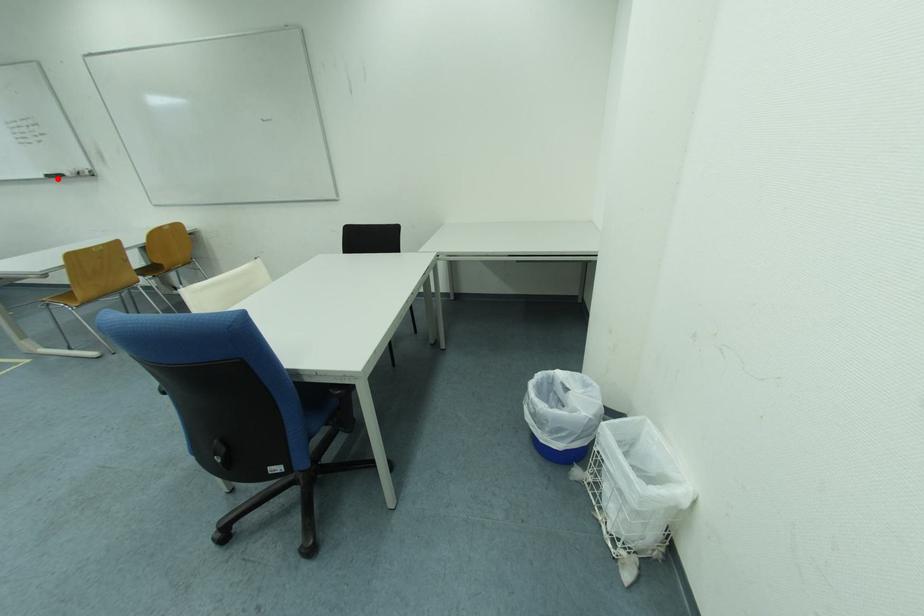
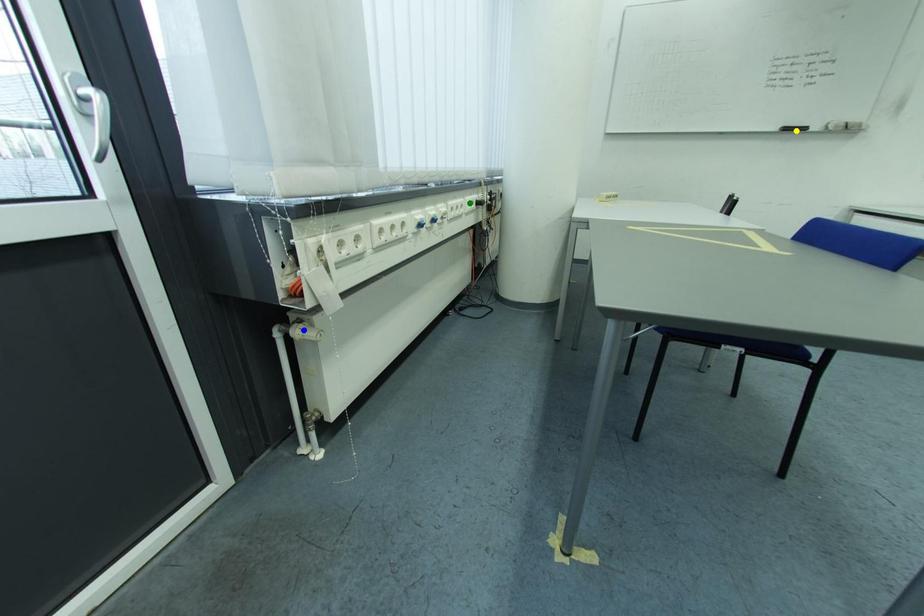
Question: I am providing you with two images of the same scene from different viewpoints. A red point is marked on the first image. You are given multiple points on the second image. Which point in image 2 is actually the same real-world point as the red point in image 1?

Choices:
 (A) green point
 (B) blue point
 (C) yellow point

Answer: (C)